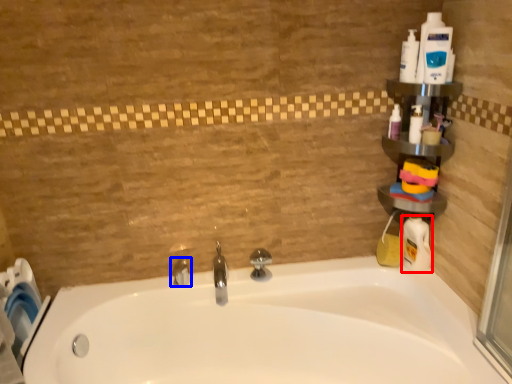
Question: Which object is further to the camera taking this photo, cleaning product (highlighted by a red box) or tap (highlighted by a blue box)?

Choices:
 (A) cleaning product
 (B) tap

Answer: (B)